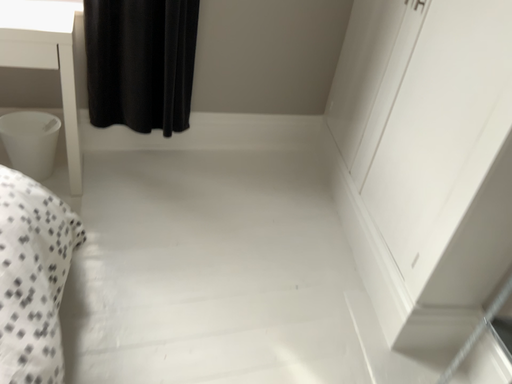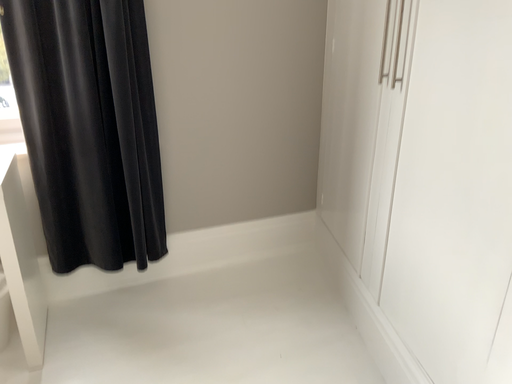
Question: How did the camera likely rotate when shooting the video?

Choices:
 (A) rotated upward
 (B) rotated downward

Answer: (A)